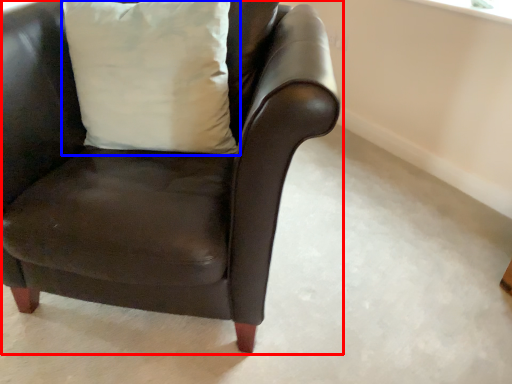
Question: Which object appears farthest to the camera in this image, chair (highlighted by a red box) or pillow (highlighted by a blue box)?

Choices:
 (A) chair
 (B) pillow

Answer: (B)